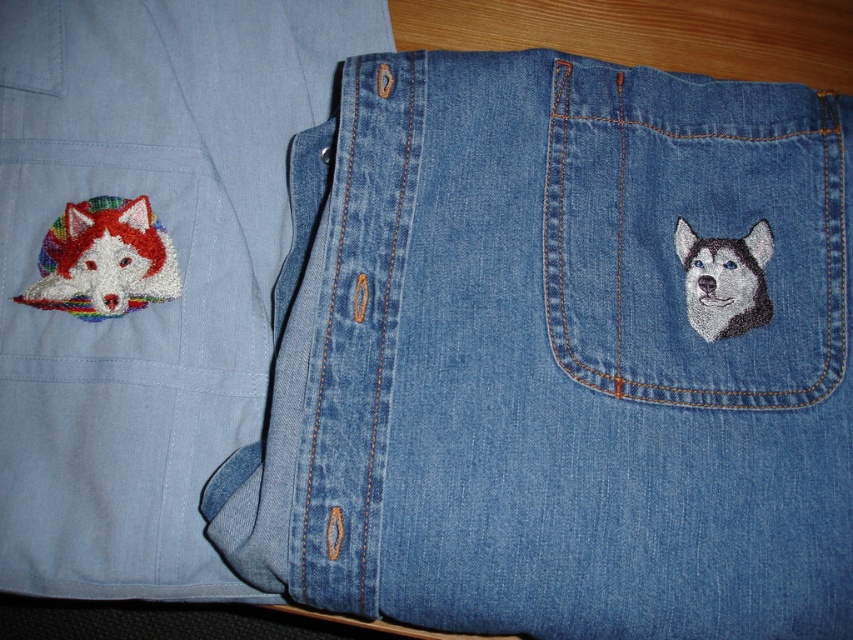
Between denim at upper right and multicolored embroidered dog at left, which one has more height?

Standing taller between the two is denim at upper right.

Does denim at upper right come behind multicolored embroidered dog at left?

No, it is in front of multicolored embroidered dog at left.

Who is more forward, (639, 504) or (71, 241)?

Point (639, 504) is more forward.

You are a GUI agent. You are given a task and a screenshot of the screen. Output one action in this format:
    pyautogui.click(x=<x>, y=<y>)
    Task: Click on the denim at upper right
    The image size is (853, 640).
    Given the screenshot: What is the action you would take?
    pyautogui.click(x=555, y=358)

Can you confirm if matte denim shirt at left is shorter than white fur dog at upper right?

No.

Which is behind, point (244, 344) or point (689, 273)?

The point (244, 344) is behind.

Find the location of a particular element. matte denim shirt at left is located at coordinates tap(144, 272).

In order to click on multicolored embroidered dog at left in this screenshot , I will do `click(103, 259)`.

Does point (120, 272) come in front of point (689, 300)?

No, (120, 272) is further to viewer.

Between point (53, 292) and point (689, 278), which one is positioned in front?

Point (689, 278) is in front.

Locate an element on the screen. This screenshot has height=640, width=853. multicolored embroidered dog at left is located at coordinates (103, 259).